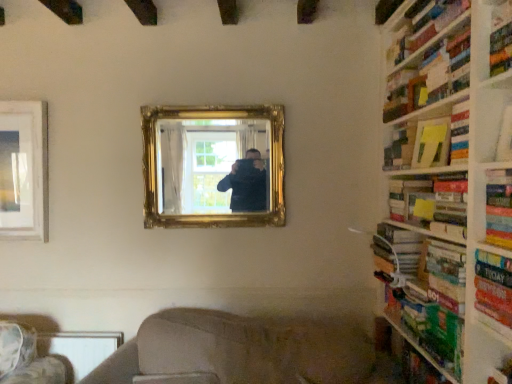
Question: In terms of height, does hardcover book at right, the third book in the bottom-to-top sequence, look taller or shorter compared to green cardboard bookshelf at right, which is counted as the 3th shelf, starting from the front?

Choices:
 (A) tall
 (B) short

Answer: (B)

Question: Visually, is hardcover book at right, which is the fourth book from top to bottom, positioned to the left or to the right of green cardboard bookshelf at right, which ranks as the 3th shelf in top-to-bottom order?

Choices:
 (A) right
 (B) left

Answer: (B)

Question: Which is farther from the white paper at upper right, which appears as the 2th shelf when ordered from the bottom?

Choices:
 (A) green cardboard bookshelf at right, which ranks as the 3th shelf in top-to-bottom order
 (B) hardcover book at right, which is counted as the 3th book, starting from the top
 (C) yellow matte paper at upper right
 (D) hardcover book at right, the third book in the bottom-to-top sequence
 (E) gold ornate mirror at center

Answer: (E)

Question: Which of these objects is positioned farthest from the hardcover book at right, which is the fourth book from top to bottom?

Choices:
 (A) green matte book at right, acting as the 1th book starting from the bottom
 (B) hardcover book at right, the second book when ordered from bottom to top
 (C) wooden bookshelf at right
 (D) white paper at upper right, the 2th shelf when ordered from top to bottom
 (E) green cardboard bookshelf at right, which is the first shelf from bottom to top

Answer: (E)